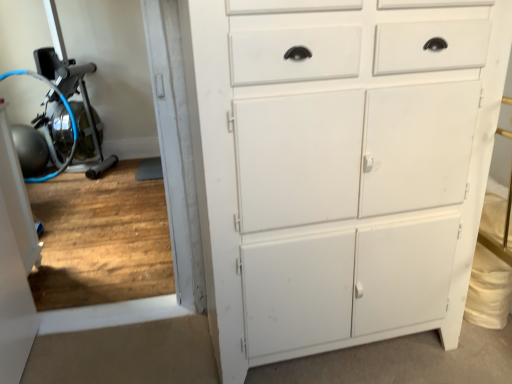
Image resolution: width=512 pixels, height=384 pixels. What do you see at coordinates (339, 166) in the screenshot?
I see `white matte cabinet at center` at bounding box center [339, 166].

At what (x,y) coordinates should I click in order to perform the action: click on white matte cabinet at center. Please return your answer as a coordinate pair (x, y). Looking at the image, I should click on (339, 166).

Measure the distance between point [297,187] and camera.

Point [297,187] and camera are 3.85 feet apart.

In order to click on white matte cabinet at center in this screenshot , I will do `click(339, 166)`.